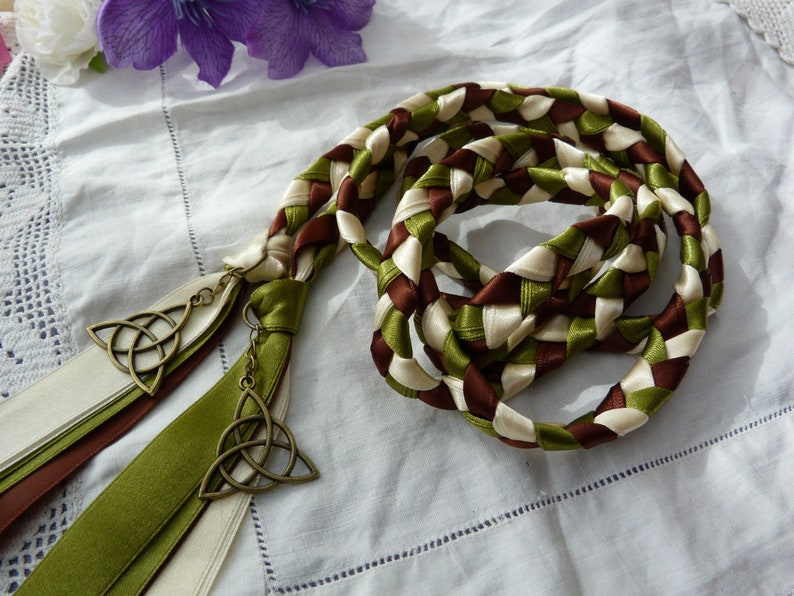
Image resolution: width=794 pixels, height=596 pixels. What are the coordinates of `table cloth` in the screenshot? It's located at (205, 166), (675, 440), (725, 539).